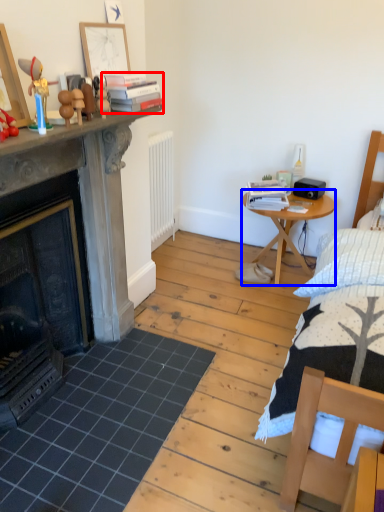
Question: Among these objects, which one is farthest to the camera, book (highlighted by a red box) or nightstand (highlighted by a blue box)?

Choices:
 (A) book
 (B) nightstand

Answer: (B)